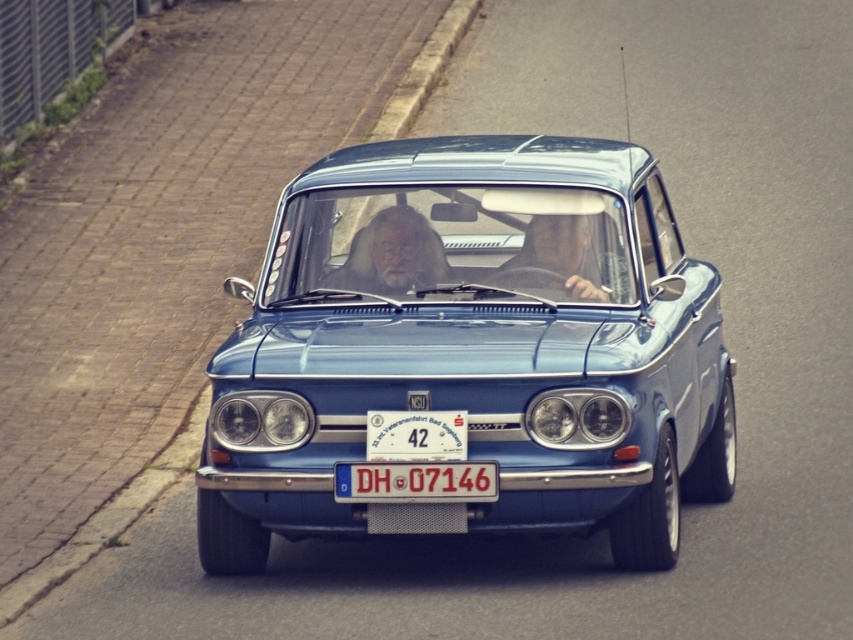
This screenshot has width=853, height=640. Describe the element at coordinates (471, 358) in the screenshot. I see `metallic blue car at center` at that location.

Who is positioned more to the right, metallic blue car at center or smooth leather face at center?

smooth leather face at center

I want to click on metallic blue car at center, so click(x=471, y=358).

Does gray hair and beard at center have a larger size compared to smooth leather face at center?

Correct, gray hair and beard at center is larger in size than smooth leather face at center.

Between point (444, 253) and point (543, 253), which one is positioned behind?

The point (444, 253) is behind.

At what (x,y) coordinates should I click in order to perform the action: click on gray hair and beard at center. Please return your answer as a coordinate pair (x, y). The image size is (853, 640). Looking at the image, I should click on (392, 253).

Find the location of a particular element. gray hair and beard at center is located at coordinates (392, 253).

Can you confirm if metallic blue car at center is shorter than white plastic license plate at center?

No.

Who is shorter, metallic blue car at center or white plastic license plate at center?

white plastic license plate at center is shorter.

Between point (463, 145) and point (454, 497), which one is positioned in front?

Point (454, 497)

Image resolution: width=853 pixels, height=640 pixels. Identify the location of metallic blue car at center. (471, 358).